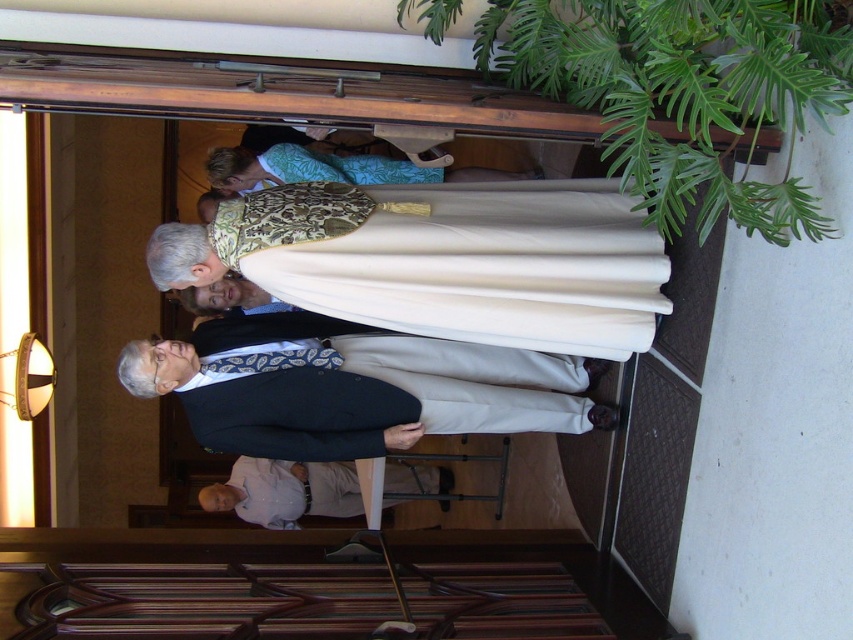
You are standing in the church and want to find the dark blue suit at center. According to the image, where should you look?

The dark blue suit at center is located at the 2D coordinates point of (355, 387).

You are organizing a charity event and need to ensure proper seating arrangements. The dark blue suit at center and the light beige fabric shirt at lower center are both attending. Given their sizes, which attendee requires a larger chair?

The dark blue suit at center requires a larger chair since it is larger in size than the light beige fabric shirt at lower center.